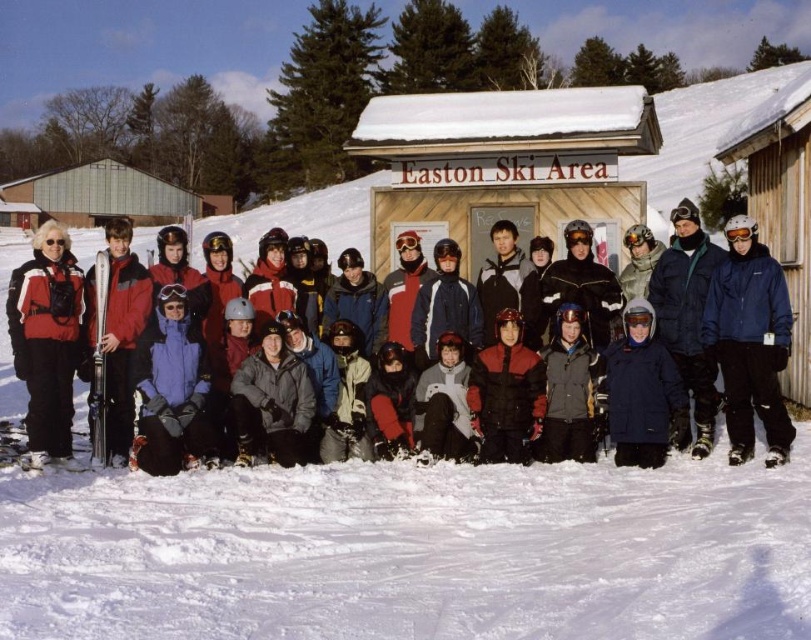
Between matte red jacket at left and brushed metal hut at upper left, which one is positioned lower?

matte red jacket at left

Who is positioned more to the left, matte red jacket at left or brushed metal hut at upper left?

brushed metal hut at upper left

Is point (71, 276) closer to camera compared to point (22, 180)?

Yes, point (71, 276) is closer to viewer.

Identify the location of matte red jacket at left. This screenshot has height=640, width=811. (46, 339).

From the picture: Can you confirm if matte black jacket at center is positioned to the left of matte red jacket at left?

Indeed, matte black jacket at center is positioned on the left side of matte red jacket at left.

Which is more to the right, matte black jacket at center or matte red jacket at left?

From the viewer's perspective, matte red jacket at left appears more on the right side.

This screenshot has width=811, height=640. What do you see at coordinates (295, 224) in the screenshot?
I see `matte black jacket at center` at bounding box center [295, 224].

The image size is (811, 640). What are the coordinates of `matte black jacket at center` in the screenshot? It's located at (295, 224).

Measure the distance from blue waterproof jacket at right to matte red jacket at left.

blue waterproof jacket at right and matte red jacket at left are 7.78 meters apart.

Does blue waterproof jacket at right appear on the right side of matte red jacket at left?

Correct, you'll find blue waterproof jacket at right to the right of matte red jacket at left.

This screenshot has height=640, width=811. Identify the location of blue waterproof jacket at right. pyautogui.click(x=749, y=340).

Identify the location of blue waterproof jacket at right. (749, 340).